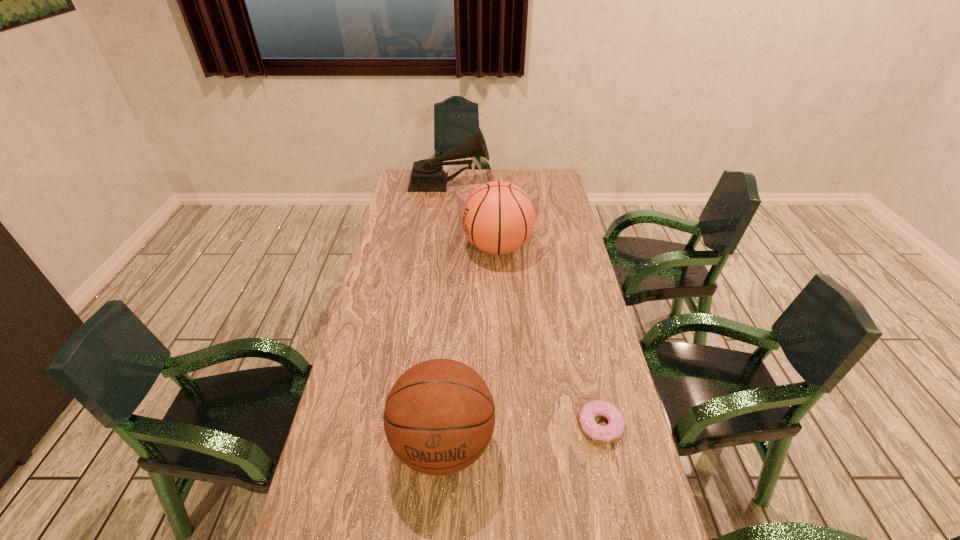
Where is `the farthest object`? the farthest object is located at coordinates (427, 175).

Identify the location of the farther basketball. (498, 217).

Identify the location of the nearer basketball. Image resolution: width=960 pixels, height=540 pixels. (439, 416).

Find the location of a particular element. Image resolution: width=960 pixels, height=540 pixels. the rightmost object is located at coordinates (613, 431).

This screenshot has height=540, width=960. In order to click on the shortest object in this screenshot , I will do `click(613, 431)`.

Where is `vacant space located from the horn of the farthest object`? The height and width of the screenshot is (540, 960). vacant space located from the horn of the farthest object is located at coordinates (527, 184).

Locate an element on the screen. This screenshot has width=960, height=540. vacant space located on the surface of the farther basketball near the brand logo is located at coordinates (446, 247).

Locate an element on the screen. This screenshot has height=540, width=960. vacant area situated 0.290m on the surface of the farther basketball near the brand logo is located at coordinates (384, 247).

The width and height of the screenshot is (960, 540). Find the location of `free spot located on the surface of the farther basketball near the brand logo`. free spot located on the surface of the farther basketball near the brand logo is located at coordinates (408, 247).

Find the location of a particular element. vacant space situated 0.230m on the left of the shortest object is located at coordinates (484, 425).